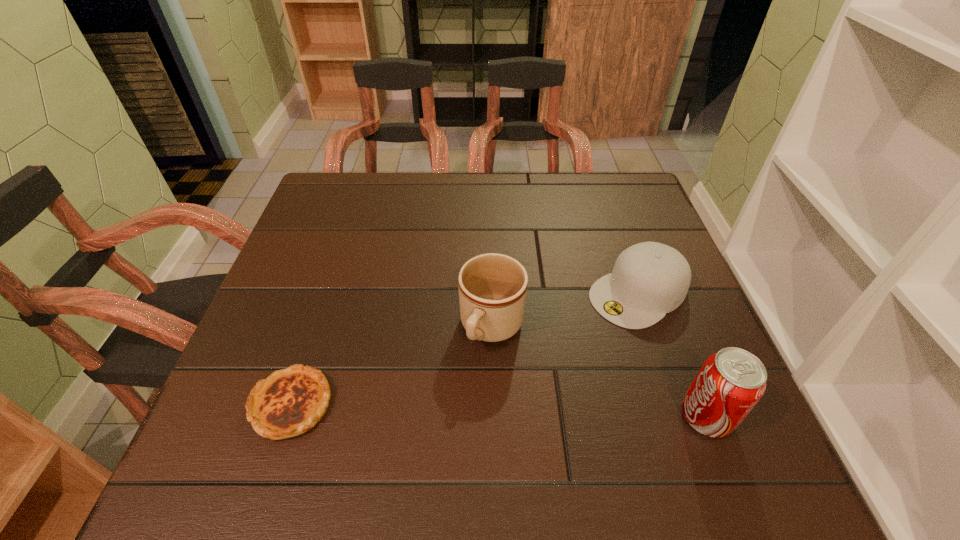
In order to click on blank area located 0.390m on the front-facing side of the third tallest object in this screenshot , I will do `click(454, 412)`.

This screenshot has height=540, width=960. I want to click on free point located on the front-facing side of the third tallest object, so click(x=538, y=357).

In order to click on quiche at the near edge in this screenshot , I will do `click(291, 401)`.

You are a GUI agent. You are given a task and a screenshot of the screen. Output one action in this format:
    pyautogui.click(x=<x>, y=<y>)
    Task: Click on the soda present at the near edge
    The height and width of the screenshot is (540, 960).
    Given the screenshot: What is the action you would take?
    pyautogui.click(x=730, y=383)

The height and width of the screenshot is (540, 960). In order to click on object that is at the left edge in this screenshot , I will do `click(291, 401)`.

Locate an element on the screen. This screenshot has width=960, height=540. soda at the right edge is located at coordinates (730, 383).

Locate an element on the screen. This screenshot has height=540, width=960. cap situated at the right edge is located at coordinates (649, 279).

Locate an element on the screen. This screenshot has height=540, width=960. object that is at the near left corner is located at coordinates (291, 401).

You are a GUI agent. You are given a task and a screenshot of the screen. Output one action in this format:
    pyautogui.click(x=<x>, y=<y>)
    Task: Click on the object that is at the near right corner
    
    Given the screenshot: What is the action you would take?
    pyautogui.click(x=730, y=383)

At what (x,y) coordinates should I click in order to perform the action: click on blank space at the far edge. Please return your answer as a coordinate pair (x, y). This screenshot has height=540, width=960. Looking at the image, I should click on (546, 179).